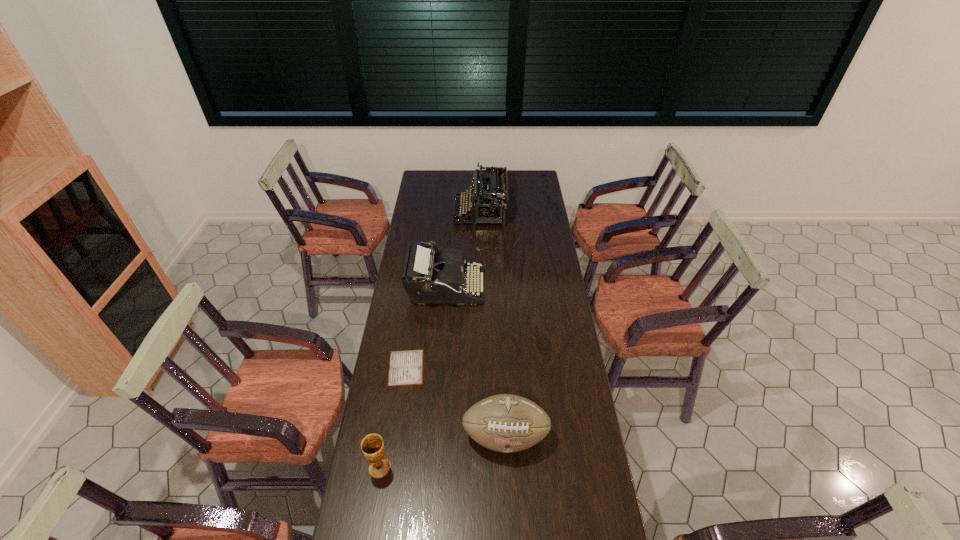
Image resolution: width=960 pixels, height=540 pixels. I want to click on free space at the left edge of the desktop, so click(388, 441).

This screenshot has height=540, width=960. I want to click on vacant space at the right edge of the desktop, so click(x=545, y=401).

Find the location of a particular element. The height and width of the screenshot is (540, 960). empty space between the shortest object and the chalice is located at coordinates (393, 418).

Find the location of a particular element. This screenshot has height=540, width=960. free spot between the diary and the chalice is located at coordinates (393, 418).

Find the location of a particular element. Image resolution: width=960 pixels, height=540 pixels. vacant space that's between the chalice and the farther typewriter is located at coordinates (430, 340).

Where is `free spot between the tallest object and the football (American)`? free spot between the tallest object and the football (American) is located at coordinates (493, 325).

The height and width of the screenshot is (540, 960). I want to click on vacant point located between the shorter typewriter and the football (American), so click(x=475, y=362).

At what (x,y) coordinates should I click in order to perform the action: click on vacant space in between the nearer typewriter and the farthest object. Please return your answer as a coordinate pair (x, y). The image size is (960, 540). Looking at the image, I should click on (463, 251).

Locate an element on the screen. The height and width of the screenshot is (540, 960). vacant space in between the nearer typewriter and the football (American) is located at coordinates (475, 362).

Identify the location of the second closest object relative to the chalice. (406, 367).